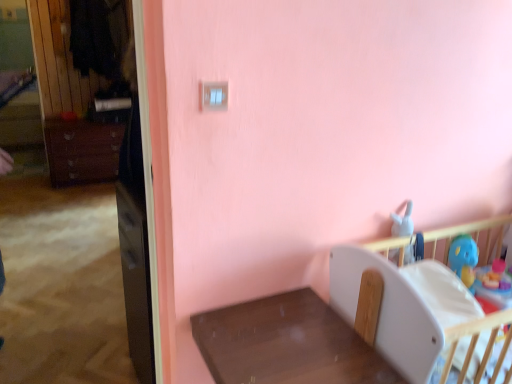
Question: From a real-world perspective, is matte black file cabinet at left located higher than brown wooden table at lower center?

Choices:
 (A) no
 (B) yes

Answer: (B)

Question: Is matte black file cabinet at left smaller than brown wooden table at lower center?

Choices:
 (A) yes
 (B) no

Answer: (A)

Question: Does matte black file cabinet at left have a greater height compared to brown wooden table at lower center?

Choices:
 (A) yes
 (B) no

Answer: (A)

Question: Is matte black file cabinet at left facing away from brown wooden table at lower center?

Choices:
 (A) yes
 (B) no

Answer: (B)

Question: Is matte black file cabinet at left aimed at brown wooden table at lower center?

Choices:
 (A) no
 (B) yes

Answer: (A)

Question: Is matte black file cabinet at left closer to camera compared to brown wooden table at lower center?

Choices:
 (A) yes
 (B) no

Answer: (B)

Question: Does matte black file cabinet at left appear on the left side of matte brown dresser at left?

Choices:
 (A) no
 (B) yes

Answer: (A)

Question: From the image's perspective, would you say matte black file cabinet at left is shown under matte brown dresser at left?

Choices:
 (A) yes
 (B) no

Answer: (A)

Question: Is matte black file cabinet at left bigger than matte brown dresser at left?

Choices:
 (A) yes
 (B) no

Answer: (B)

Question: Is matte black file cabinet at left to the right of matte brown dresser at left from the viewer's perspective?

Choices:
 (A) no
 (B) yes

Answer: (B)

Question: Does matte black file cabinet at left lie behind matte brown dresser at left?

Choices:
 (A) yes
 (B) no

Answer: (B)

Question: From a real-world perspective, is matte black file cabinet at left physically above matte brown dresser at left?

Choices:
 (A) no
 (B) yes

Answer: (B)

Question: Is white plastic infant bed at lower right positioned in front of blue rubber duck at right?

Choices:
 (A) no
 (B) yes

Answer: (B)